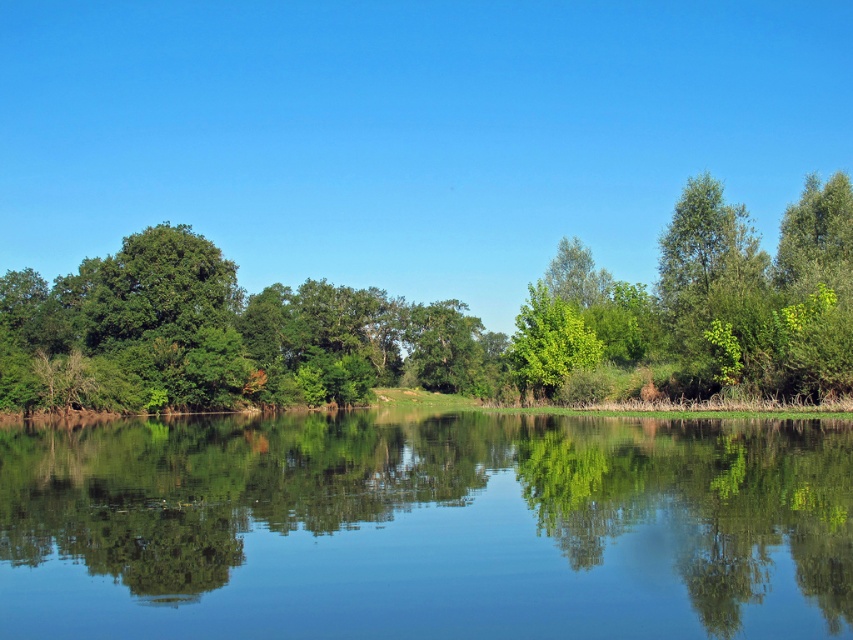
You are standing at the edge of the water in the serene landscape. You notice two points marked in the scene. The first point, point (825, 324), is near the water surface, and the second point, point (599, 342), is higher up. If you want to reach the point that is closer to you, which one should you head towards?

You should head towards point (825, 324) because it is in front of point (599, 342), making it closer to your current position at the water edge.

You are standing on the edge of the water and want to take a photo of both the transparent water at center and the green leafy tree at center. Which object should you focus on first if you want to capture both in one frame without moving your camera?

You should focus on the green leafy tree at center first because it is taller than the transparent water at center, so adjusting the focus to the tree ensures both are in the frame.

You are standing at the edge of the water and want to walk to the green leafy tree at center. Which direction should you move relative to the transparent water at center?

You should move to the right side of the transparent water at center to reach the green leafy tree at center since the transparent water at center is positioned on the left side of the green leafy tree at center.